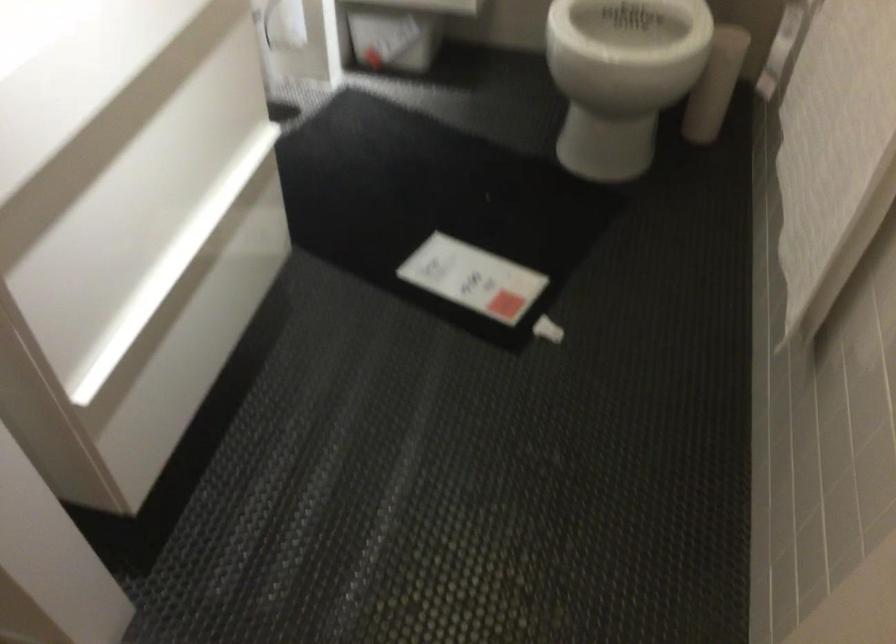
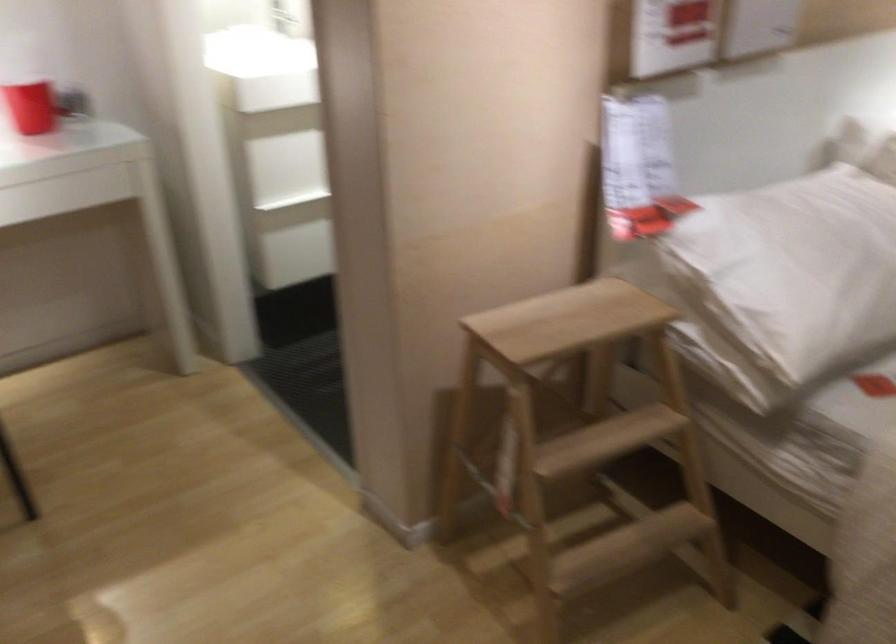
Question: I am providing you with two images of the same scene from different viewpoints. Which of the following objects are not visible in image2?

Choices:
 (A) blue bag strap
 (B) red cup
 (C) white toilet lid
 (D) wooden step stool

Answer: (C)